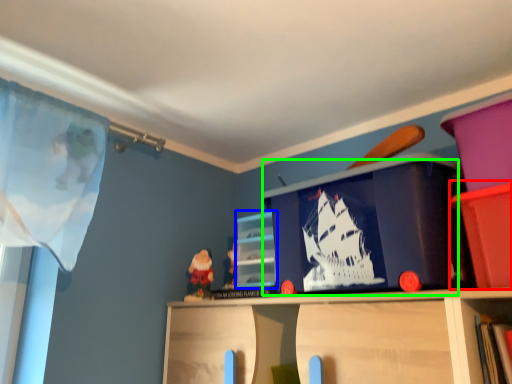
Question: Which object is the farthest from cabinet (highlighted by a red box)? Choose among these: cabinet (highlighted by a blue box) or window screen (highlighted by a green box).

Choices:
 (A) cabinet
 (B) window screen

Answer: (A)